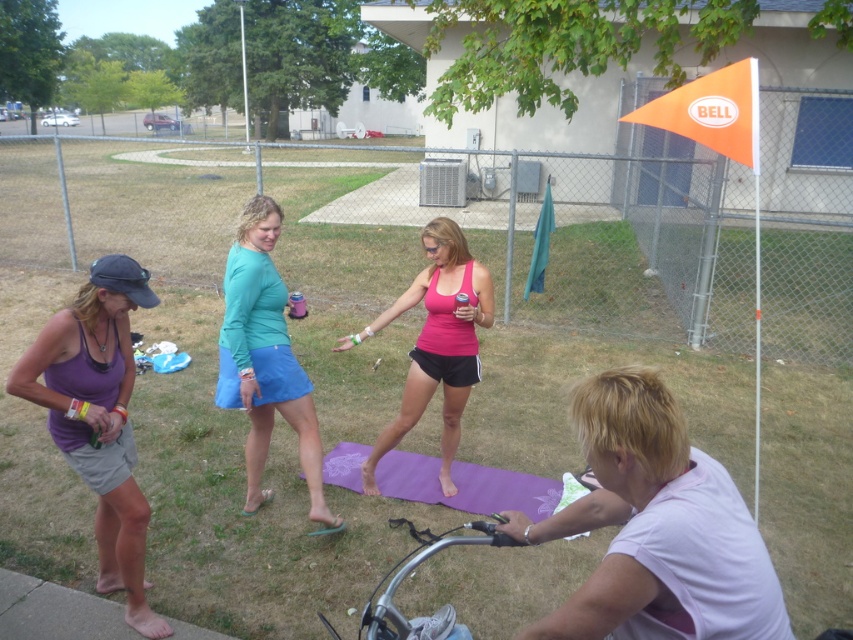
You are a photographer trying to capture a clear shot of the silver metallic bicycle handlebars at lower center without any obstruction. Given that the purple matte tank top at left is in the way, where should you position yourself relative to the current viewpoint to ensure the handlebars are visible?

Since the purple matte tank top at left is located above the silver metallic bicycle handlebars at lower center, moving your position lower or to the side would allow you to see the handlebars without obstruction from the tank top.

You are trying to decide which item to grab first. The purple matte tank top at left is narrower than the silver metallic bicycle handlebars at lower center. Which object is wider?

The silver metallic bicycle handlebars at lower center are wider than the purple matte tank top at left.

You are organizing a clothing donation drive and need to categorize items based on their material thickness. You have two items to assess from the image provided. Which of the two items, the purple matte tank top at left or the teal fabric skirt at center, should be placed in the section for thinner materials?

The purple matte tank top at left is thinner than the teal fabric skirt at center, so it should be placed in the section for thinner materials.